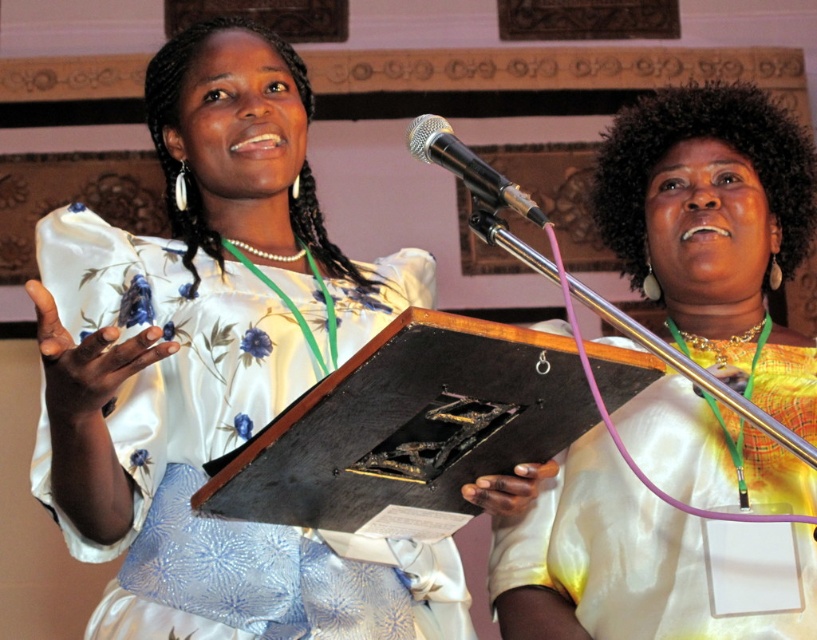
You are a photographer at a ceremony. You need to capture a photo of the satin floral dress at center and the black wood plaque at center. Which object is taller so that you can adjust your camera angle accordingly?

The satin floral dress at center is taller than the black wood plaque at center, so adjust the camera angle to focus on the taller dress first.

What is located at the coordinates point (x=717, y=228)?

The point (x=717, y=228) is occupied by the matte gold blouse at center.